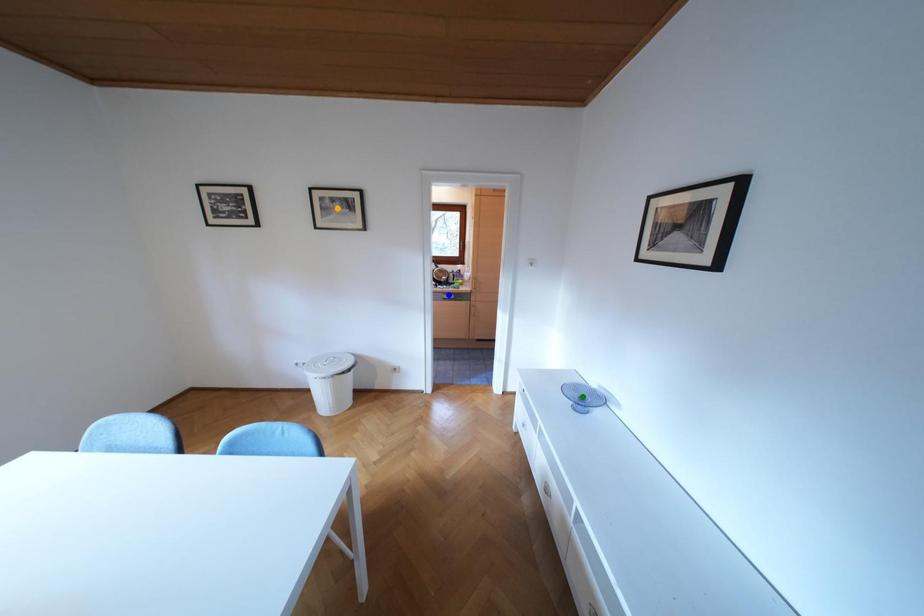
Order these from nearest to farthest:
orange point | green point | blue point

blue point < orange point < green point